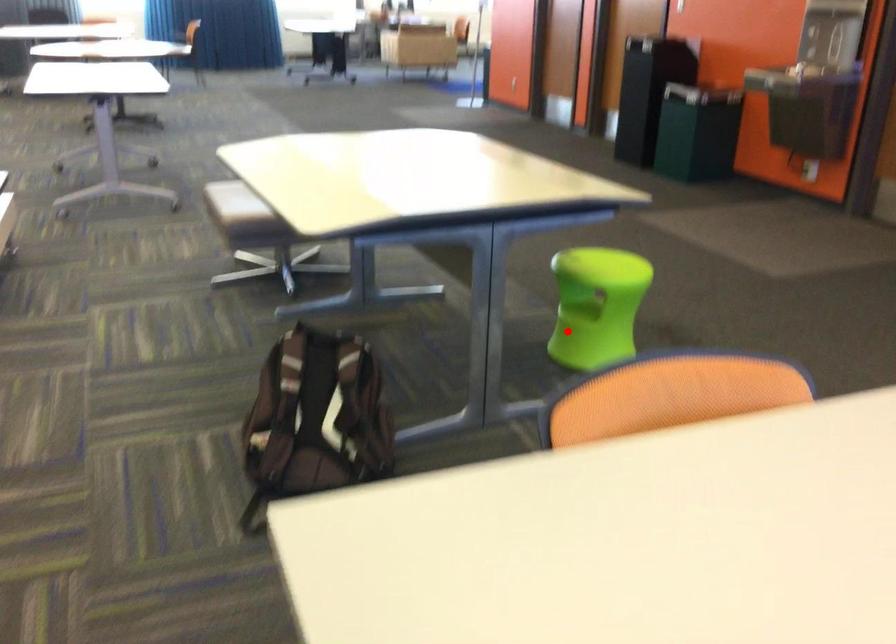
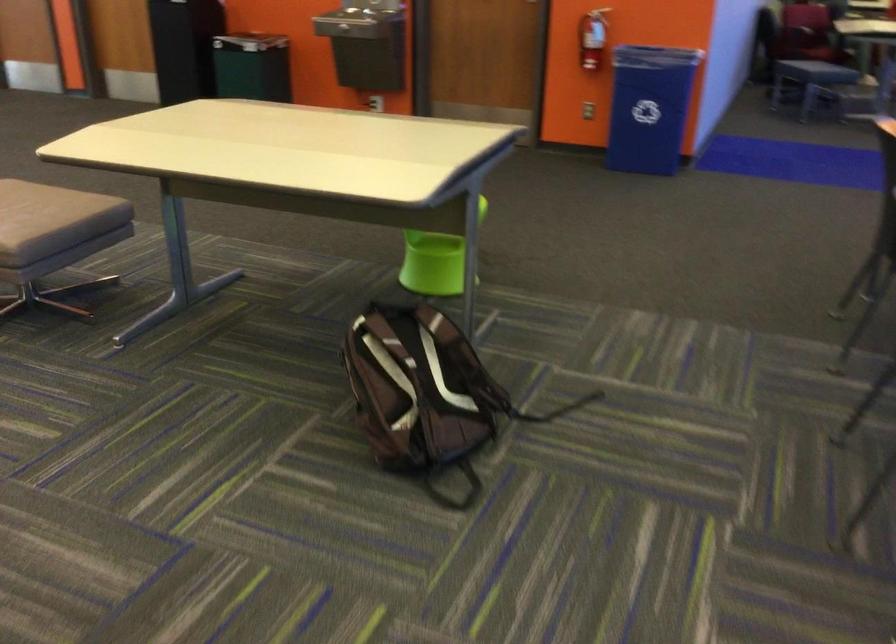
Question: I am providing you with two images of the same scene from different viewpoints. Image1 has a red point marked. In image2, the corresponding 3D location appears at what relative position? Reply with the corresponding letter.

Choices:
 (A) Closer
 (B) Farther

Answer: (B)